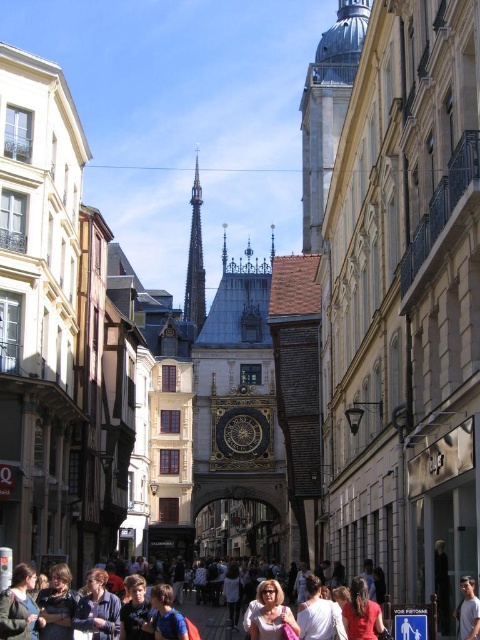
Does green fabric jacket at lower left lie behind red cotton shirt at lower center?

No, green fabric jacket at lower left is in front of red cotton shirt at lower center.

Does point (2, 605) come in front of point (373, 628)?

That is True.

Does point (17, 625) come in front of point (374, 625)?

Yes, it is in front of point (374, 625).

Identify the location of green fabric jacket at lower left. This screenshot has height=640, width=480. (19, 605).

Between point (310, 204) and point (96, 620), which one is positioned in front?

Point (96, 620)

Locate an element on the screen. This screenshot has width=480, height=640. silver metallic bell tower at upper center is located at coordinates pyautogui.click(x=327, y=109).

Who is more distant from viewer, (x=322, y=220) or (x=96, y=600)?

Positioned behind is point (x=322, y=220).

Where is `silver metallic bell tower at upper center`? Image resolution: width=480 pixels, height=640 pixels. silver metallic bell tower at upper center is located at coordinates (327, 109).

Who is more forward, (160, 632) or (239, 609)?

Point (160, 632) is in front.

Which is in front, point (156, 605) or point (228, 573)?

Positioned in front is point (156, 605).

This screenshot has height=640, width=480. I want to click on blue fabric shirt at center, so click(167, 614).